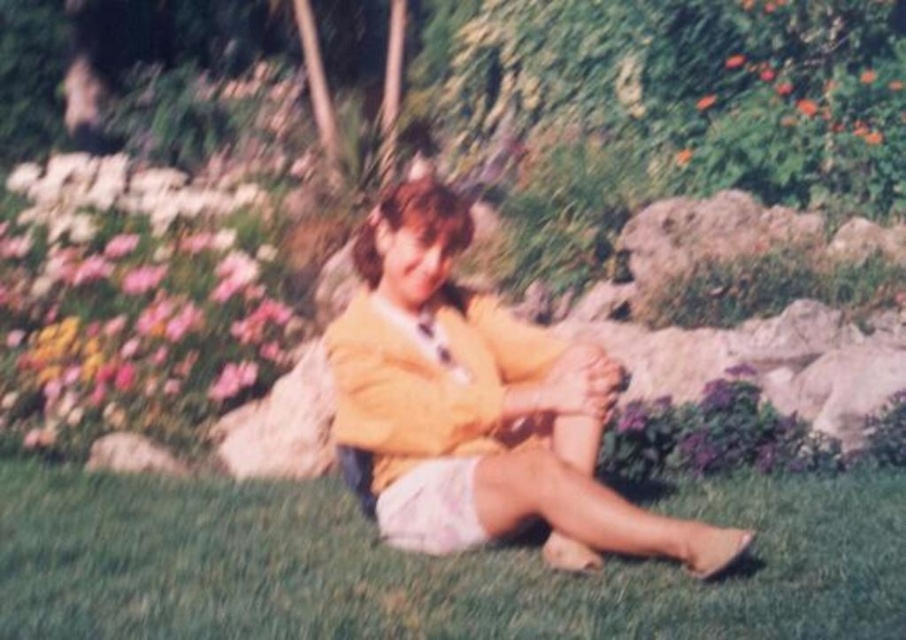
Question: Can you confirm if yellow matte jacket at center is positioned above pink satin skirt at lower center?

Choices:
 (A) no
 (B) yes

Answer: (B)

Question: Is yellow matte jacket at center to the left of pink satin skirt at lower center from the viewer's perspective?

Choices:
 (A) yes
 (B) no

Answer: (B)

Question: Which of these objects is positioned closest to the green grass at lower center?

Choices:
 (A) pink satin skirt at lower center
 (B) yellow matte jacket at center
 (C) pink matte flower at left

Answer: (A)

Question: Among these points, which one is nearest to the camera?

Choices:
 (A) (52, 250)
 (B) (747, 477)
 (C) (349, 376)
 (D) (381, 497)

Answer: (C)

Question: Based on their relative distances, which object is nearer to the yellow matte jacket at center?

Choices:
 (A) pink satin skirt at lower center
 (B) pink matte flower at left

Answer: (A)

Question: Is yellow matte jacket at center smaller than pink satin skirt at lower center?

Choices:
 (A) yes
 (B) no

Answer: (B)